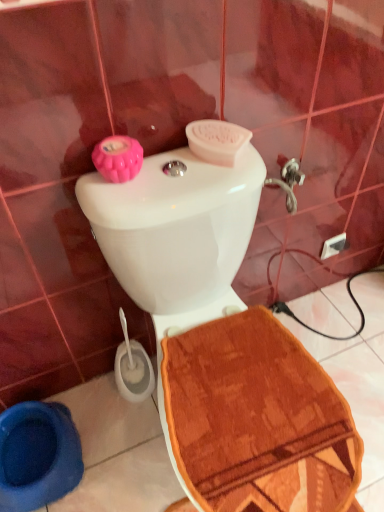
Question: Is blue rubber toilet bowl at lower left in front of or behind white glossy toilet at center in the image?

Choices:
 (A) behind
 (B) front

Answer: (A)

Question: From their relative heights in the image, would you say blue rubber toilet bowl at lower left is taller or shorter than white glossy toilet at center?

Choices:
 (A) tall
 (B) short

Answer: (B)

Question: Would you say blue rubber toilet bowl at lower left is inside or outside white glossy toilet at center?

Choices:
 (A) inside
 (B) outside

Answer: (B)

Question: Is white glossy toilet at center bigger or smaller than blue rubber toilet bowl at lower left?

Choices:
 (A) small
 (B) big

Answer: (B)

Question: Considering the positions of white glossy toilet at center and blue rubber toilet bowl at lower left in the image, is white glossy toilet at center wider or thinner than blue rubber toilet bowl at lower left?

Choices:
 (A) thin
 (B) wide

Answer: (B)

Question: Is white glossy toilet at center taller or shorter than blue rubber toilet bowl at lower left?

Choices:
 (A) short
 (B) tall

Answer: (B)

Question: In the image, is white glossy toilet at center on the left side or the right side of blue rubber toilet bowl at lower left?

Choices:
 (A) left
 (B) right

Answer: (B)